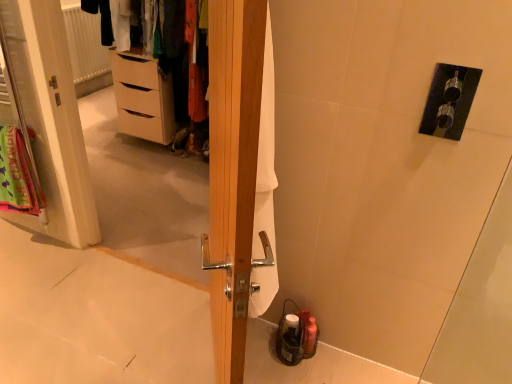
Question: Is neon green fabric at left not close to white fabric screen door at left?

Choices:
 (A) no
 (B) yes

Answer: (A)

Question: Does neon green fabric at left have a greater height compared to white fabric screen door at left?

Choices:
 (A) no
 (B) yes

Answer: (A)

Question: Can you confirm if neon green fabric at left is shorter than white fabric screen door at left?

Choices:
 (A) no
 (B) yes

Answer: (B)

Question: Is neon green fabric at left at the left side of white fabric screen door at left?

Choices:
 (A) yes
 (B) no

Answer: (A)

Question: From the image's perspective, is neon green fabric at left below white fabric screen door at left?

Choices:
 (A) yes
 (B) no

Answer: (A)

Question: In terms of width, does matte white dresser at upper left look wider or thinner when compared to light brown wooden chest of drawers at left?

Choices:
 (A) wide
 (B) thin

Answer: (B)

Question: From a real-world perspective, is matte white dresser at upper left physically located above or below light brown wooden chest of drawers at left?

Choices:
 (A) below
 (B) above

Answer: (B)

Question: From the image's perspective, is matte white dresser at upper left located above or below light brown wooden chest of drawers at left?

Choices:
 (A) below
 (B) above

Answer: (B)

Question: Is matte white dresser at upper left in front of or behind light brown wooden chest of drawers at left in the image?

Choices:
 (A) behind
 (B) front

Answer: (B)

Question: From the image's perspective, relative to white textured radiator at upper left, is wooden door at center above or below?

Choices:
 (A) above
 (B) below

Answer: (B)

Question: In the image, is wooden door at center on the left side or the right side of white textured radiator at upper left?

Choices:
 (A) left
 (B) right

Answer: (B)

Question: Considering the positions of wooden door at center and white textured radiator at upper left in the image, is wooden door at center wider or thinner than white textured radiator at upper left?

Choices:
 (A) thin
 (B) wide

Answer: (B)

Question: Based on their sizes in the image, would you say wooden door at center is bigger or smaller than white textured radiator at upper left?

Choices:
 (A) big
 (B) small

Answer: (A)

Question: Based on their sizes in the image, would you say wooden door at center is bigger or smaller than neon green fabric at left?

Choices:
 (A) small
 (B) big

Answer: (B)

Question: Considering the positions of point (236, 1) and point (0, 205), is point (236, 1) closer or farther from the camera than point (0, 205)?

Choices:
 (A) closer
 (B) farther

Answer: (A)